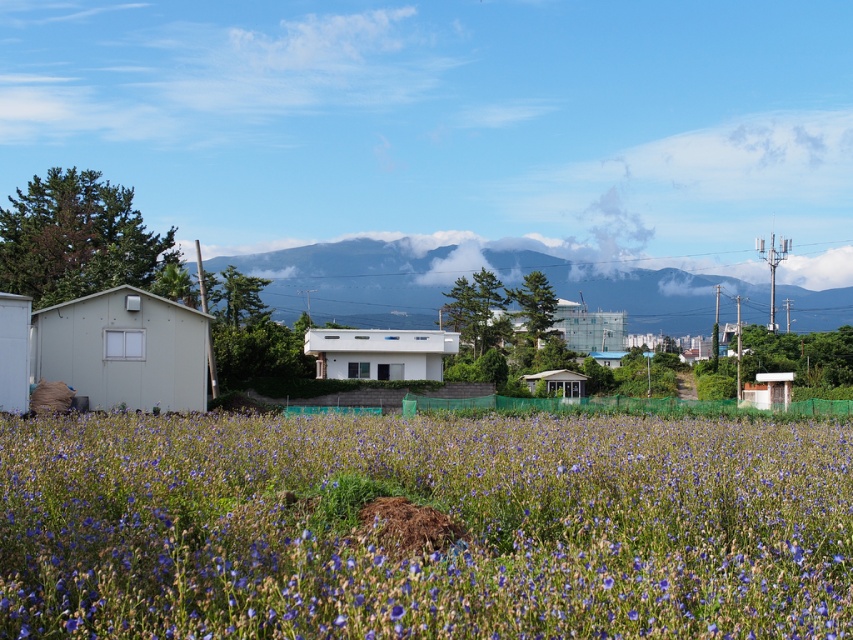
Question: Which object is the closest to the white matte house at center?

Choices:
 (A) white glossy building at center
 (B) white matte hut at center
 (C) white matte hut at left

Answer: (B)

Question: Does matte gray hut at left appear on the left side of white plastic hut at right?

Choices:
 (A) no
 (B) yes

Answer: (B)

Question: Which point is farther to the camera?

Choices:
 (A) white matte hut at left
 (B) white glossy building at center
 (C) white plastic hut at right

Answer: (B)

Question: Is matte gray hut at left positioned behind white plastic hut at right?

Choices:
 (A) yes
 (B) no

Answer: (B)

Question: In this image, where is blue matte flowers at center located relative to white matte house at center?

Choices:
 (A) below
 (B) above

Answer: (A)

Question: Which of the following is the farthest from the observer?

Choices:
 (A) white matte hut at left
 (B) white plastic hut at right
 (C) matte gray hut at left
 (D) blue matte flowers at center

Answer: (B)